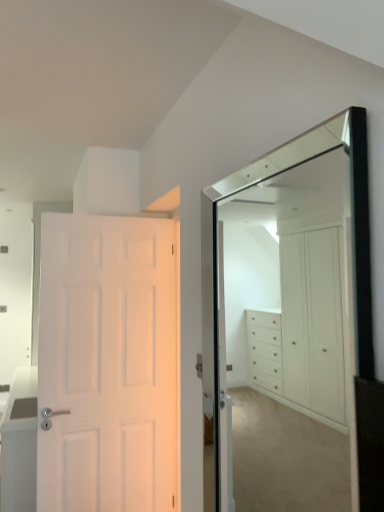
Question: Looking at the image, does white matte door at left seem bigger or smaller compared to clear glass mirror at upper right?

Choices:
 (A) small
 (B) big

Answer: (B)

Question: Do you think white matte door at left is within clear glass mirror at upper right, or outside of it?

Choices:
 (A) outside
 (B) inside

Answer: (A)

Question: Estimate the real-world distances between objects in this image. Which object is farther from the white glossy cabinet at left?

Choices:
 (A) clear glass mirror at upper right
 (B) white matte door at left

Answer: (A)

Question: Which of these objects is positioned closest to the white matte door at left?

Choices:
 (A) clear glass mirror at upper right
 (B) white glossy cabinet at left

Answer: (B)